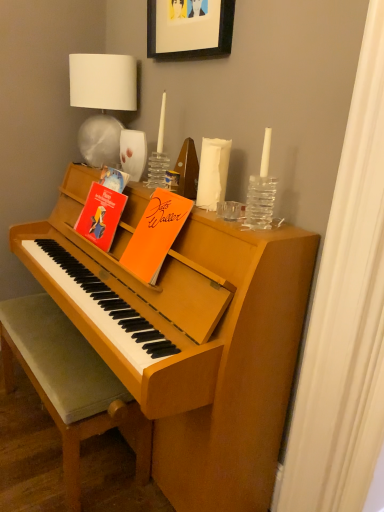
Question: Could you tell me if white fabric lampshade at upper left is facing black matte picture frame at upper center?

Choices:
 (A) yes
 (B) no

Answer: (B)

Question: Is white fabric lampshade at upper left facing away from black matte picture frame at upper center?

Choices:
 (A) yes
 (B) no

Answer: (B)

Question: Does white fabric lampshade at upper left have a lesser height compared to black matte picture frame at upper center?

Choices:
 (A) yes
 (B) no

Answer: (B)

Question: Is white fabric lampshade at upper left at the right side of black matte picture frame at upper center?

Choices:
 (A) yes
 (B) no

Answer: (B)

Question: Does white fabric lampshade at upper left have a greater width compared to black matte picture frame at upper center?

Choices:
 (A) no
 (B) yes

Answer: (B)

Question: Is white fabric lampshade at upper left beside black matte picture frame at upper center?

Choices:
 (A) no
 (B) yes

Answer: (A)

Question: From a real-world perspective, does matte paper book at upper left, the 2th paperback book when ordered from right to left, stand above black matte picture frame at upper center?

Choices:
 (A) no
 (B) yes

Answer: (A)

Question: Is black matte picture frame at upper center surrounded by matte paper book at upper left, which appears as the first paperback book when viewed from the left?

Choices:
 (A) no
 (B) yes

Answer: (A)

Question: Is matte paper book at upper left, which appears as the first paperback book when viewed from the left, positioned with its back to black matte picture frame at upper center?

Choices:
 (A) no
 (B) yes

Answer: (A)

Question: Is matte paper book at upper left, which appears as the first paperback book when viewed from the left, further to camera compared to black matte picture frame at upper center?

Choices:
 (A) no
 (B) yes

Answer: (B)

Question: Does matte paper book at upper left, which appears as the first paperback book when viewed from the left, have a lesser height compared to black matte picture frame at upper center?

Choices:
 (A) yes
 (B) no

Answer: (B)

Question: Does matte paper book at upper left, which appears as the first paperback book when viewed from the left, have a greater height compared to black matte picture frame at upper center?

Choices:
 (A) yes
 (B) no

Answer: (A)

Question: From a real-world perspective, is velvet grey cushioned bench at lower left beneath white fabric lampshade at upper left?

Choices:
 (A) yes
 (B) no

Answer: (A)